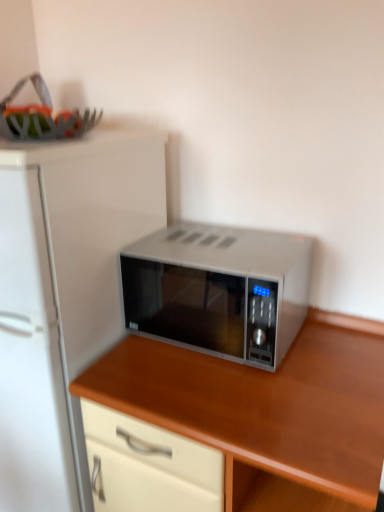
Question: Is white matte refrigerator at left facing towards satin silver microwave at center?

Choices:
 (A) no
 (B) yes

Answer: (A)

Question: Is white matte refrigerator at left to the right of satin silver microwave at center from the viewer's perspective?

Choices:
 (A) no
 (B) yes

Answer: (A)

Question: From a real-world perspective, does white matte refrigerator at left sit lower than satin silver microwave at center?

Choices:
 (A) no
 (B) yes

Answer: (A)

Question: Is white matte refrigerator at left wider than satin silver microwave at center?

Choices:
 (A) no
 (B) yes

Answer: (B)

Question: Is white matte refrigerator at left smaller than satin silver microwave at center?

Choices:
 (A) yes
 (B) no

Answer: (B)

Question: Considering the relative sizes of white matte refrigerator at left and satin silver microwave at center in the image provided, is white matte refrigerator at left taller than satin silver microwave at center?

Choices:
 (A) no
 (B) yes

Answer: (B)

Question: Does satin silver microwave at center lie in front of satin silver microwave at center?

Choices:
 (A) yes
 (B) no

Answer: (B)

Question: Is satin silver microwave at center surrounding satin silver microwave at center?

Choices:
 (A) yes
 (B) no

Answer: (B)

Question: From the image's perspective, is satin silver microwave at center below satin silver microwave at center?

Choices:
 (A) yes
 (B) no

Answer: (B)

Question: Is satin silver microwave at center turned away from satin silver microwave at center?

Choices:
 (A) yes
 (B) no

Answer: (B)

Question: Does satin silver microwave at center have a smaller size compared to satin silver microwave at center?

Choices:
 (A) no
 (B) yes

Answer: (B)

Question: Is satin silver microwave at center bigger than satin silver microwave at center?

Choices:
 (A) no
 (B) yes

Answer: (A)

Question: Considering the relative sizes of satin silver microwave at center and white matte refrigerator at left in the image provided, is satin silver microwave at center bigger than white matte refrigerator at left?

Choices:
 (A) yes
 (B) no

Answer: (B)